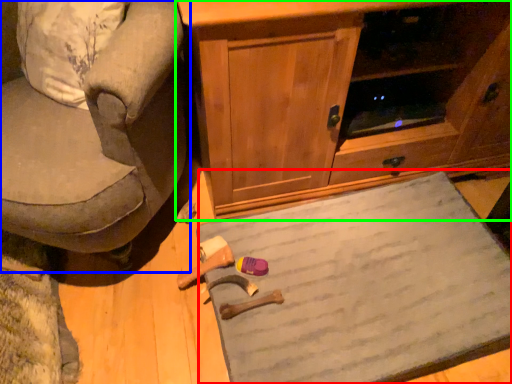
Question: Which object is positioned farthest from doormat (highlighted by a red box)? Select from chair (highlighted by a blue box) and cabinetry (highlighted by a green box).

Choices:
 (A) chair
 (B) cabinetry

Answer: (A)